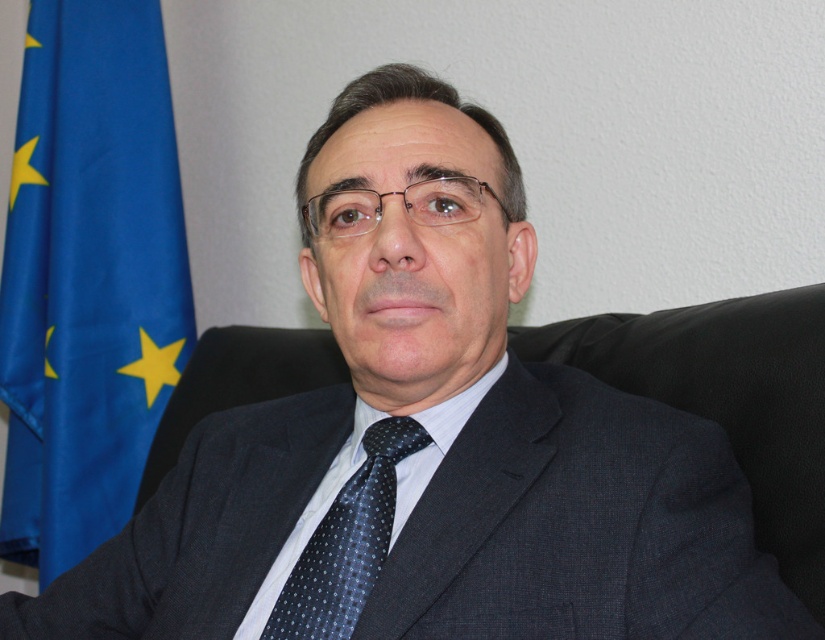
Question: Can you confirm if blue fabric flag at left is positioned below dark blue dotted silk tie at center?

Choices:
 (A) yes
 (B) no

Answer: (B)

Question: Can you confirm if blue fabric flag at left is positioned below dark blue dotted silk tie at center?

Choices:
 (A) no
 (B) yes

Answer: (A)

Question: Which of the following is the farthest from the observer?

Choices:
 (A) blue fabric flag at left
 (B) dark blue dotted silk tie at center

Answer: (A)

Question: Which point appears closest to the camera in this image?

Choices:
 (A) pos(38,547)
 (B) pos(373,506)

Answer: (B)

Question: Does blue fabric flag at left appear under dark blue dotted silk tie at center?

Choices:
 (A) no
 (B) yes

Answer: (A)

Question: Which point is closer to the camera?

Choices:
 (A) (370, 474)
 (B) (107, 516)

Answer: (A)